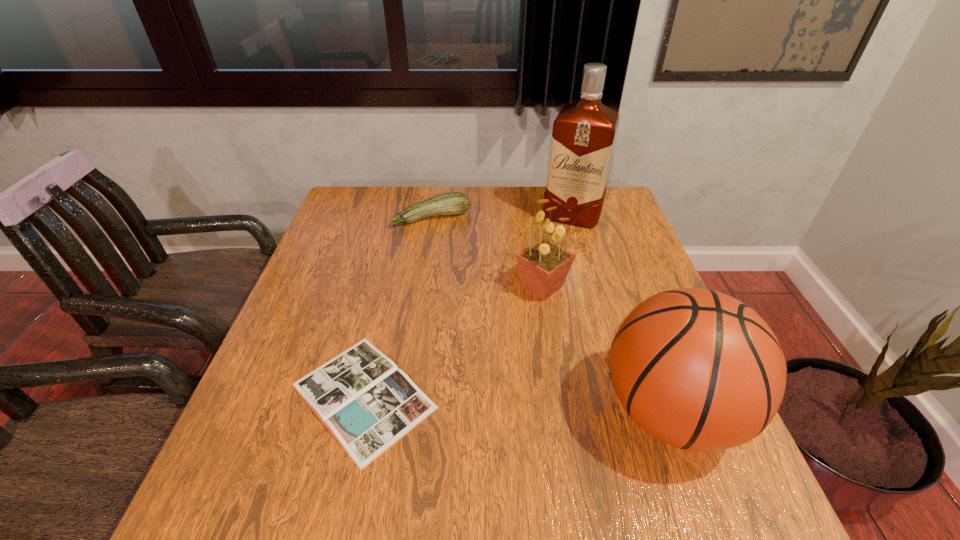
Where is `object that is the closest to the second shortest object`? This screenshot has height=540, width=960. object that is the closest to the second shortest object is located at coordinates (544, 265).

This screenshot has width=960, height=540. In order to click on vacant space that satisfies the following two spatial constraints: 1. on the front side of the zucchini; 2. on the right side of the basketball in this screenshot , I will do `click(403, 412)`.

This screenshot has width=960, height=540. What are the coordinates of `blank area in the image that satisfies the following two spatial constraints: 1. on the back side of the liquor; 2. on the right side of the shortest object` in the screenshot? It's located at (405, 217).

The width and height of the screenshot is (960, 540). In order to click on free spot that satisfies the following two spatial constraints: 1. on the back side of the shortest object; 2. on the right side of the zucchini in this screenshot , I will do `click(405, 218)`.

This screenshot has height=540, width=960. I want to click on free location that satisfies the following two spatial constraints: 1. on the back side of the zucchini; 2. on the right side of the liquor, so click(x=432, y=217).